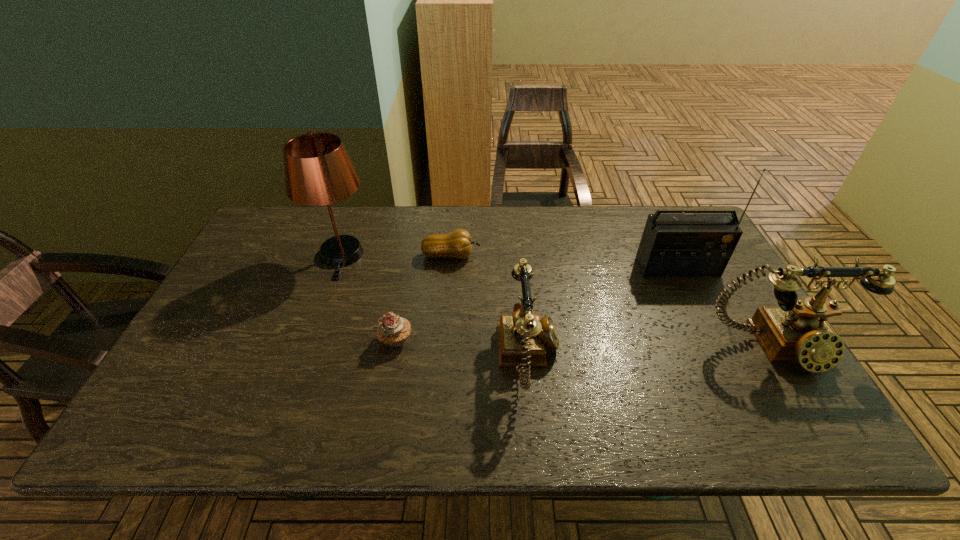
The height and width of the screenshot is (540, 960). I want to click on the left telephone, so click(x=523, y=337).

At what (x,y) coordinates should I click in order to perform the action: click on the third object from right to left. Please return your answer as a coordinate pair (x, y). The width and height of the screenshot is (960, 540). Looking at the image, I should click on (523, 337).

This screenshot has width=960, height=540. What are the coordinates of `the fourth shortest object` in the screenshot? It's located at (796, 331).

Image resolution: width=960 pixels, height=540 pixels. What are the coordinates of `the taller telephone` in the screenshot? It's located at (796, 331).

Image resolution: width=960 pixels, height=540 pixels. What are the coordinates of `lampshade` in the screenshot? It's located at (318, 171).

At what (x,y) coordinates should I click in order to perform the action: click on gourd. Please return your answer as a coordinate pair (x, y). This screenshot has width=960, height=540. Looking at the image, I should click on (458, 244).

At what (x,y) coordinates should I click in order to perform the action: click on radio receiver. Please return your answer as a coordinate pair (x, y). This screenshot has width=960, height=540. Looking at the image, I should click on (673, 245).

You are a GUI agent. You are given a task and a screenshot of the screen. Output one action in this format:
    pyautogui.click(x=<x>, y=<y>)
    Task: Click on the cupcake
    The height and width of the screenshot is (540, 960).
    Given the screenshot: What is the action you would take?
    pyautogui.click(x=393, y=331)

Where is `free space located 0.400m on the dial number of the shorter telephone`? The height and width of the screenshot is (540, 960). free space located 0.400m on the dial number of the shorter telephone is located at coordinates (725, 357).

Find the location of a particular element. The image size is (960, 540). free space located on the dial number of the fourth shortest object is located at coordinates (809, 401).